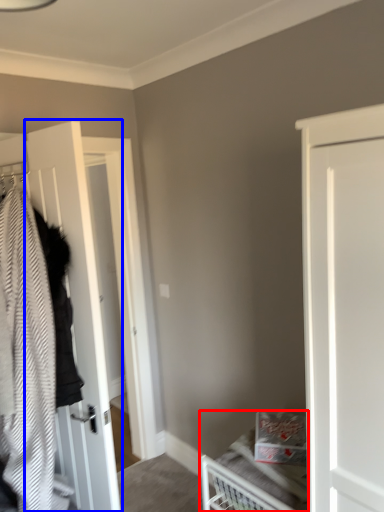
Question: Which object is closer to the camera taking this photo, bed (highlighted by a red box) or door (highlighted by a blue box)?

Choices:
 (A) bed
 (B) door

Answer: (A)